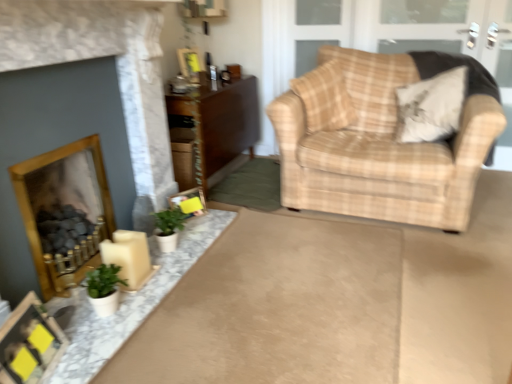
At what (x,y) coordinates should I click in order to perform the action: click on vacant space behind green matte plant at lower left, which is counted as the 1th houseplant, starting from the back. Please return your answer as a coordinate pair (x, y). The width and height of the screenshot is (512, 384). Looking at the image, I should click on (191, 225).